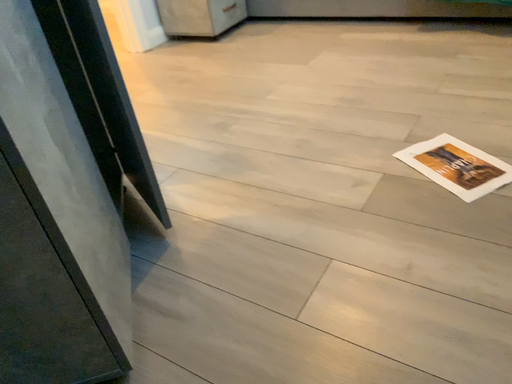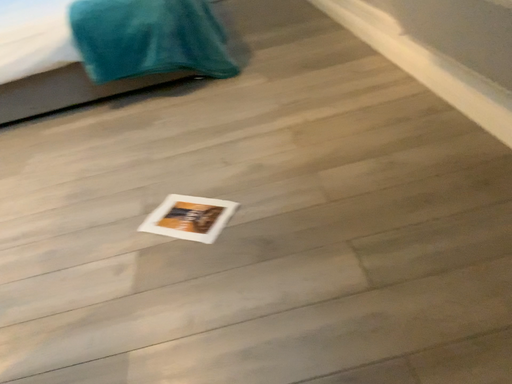
Question: Which way did the camera rotate in the video?

Choices:
 (A) rotated downward
 (B) rotated upward

Answer: (B)